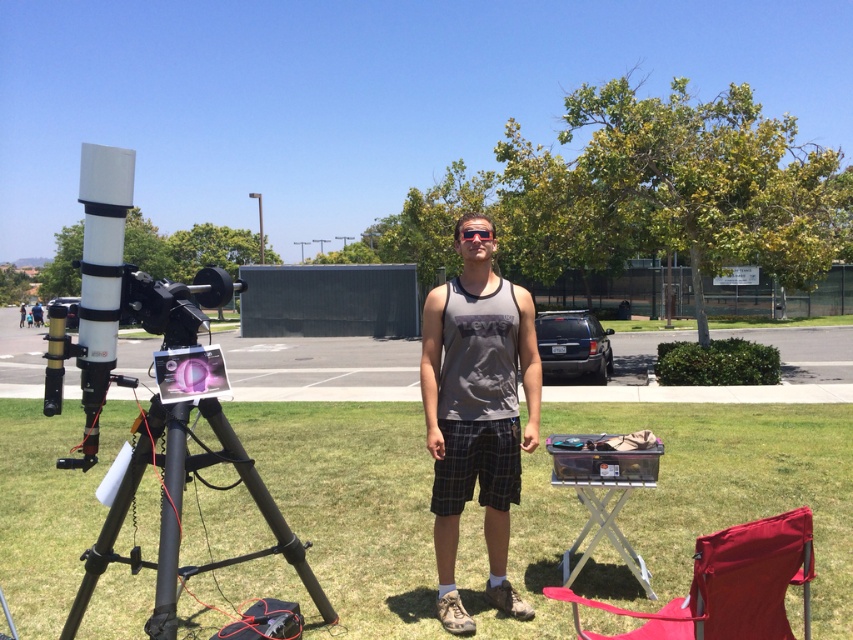
Which of these two, green grass at lower center or gray fabric tank top at center, stands shorter?

green grass at lower center

The image size is (853, 640). What do you see at coordinates (726, 492) in the screenshot?
I see `green grass at lower center` at bounding box center [726, 492].

Describe the element at coordinates (726, 492) in the screenshot. I see `green grass at lower center` at that location.

Where is `green grass at lower center`? green grass at lower center is located at coordinates (x=726, y=492).

Does green grass at lower center have a lesser height compared to black matte tripod at lower left?

Correct, green grass at lower center is not as tall as black matte tripod at lower left.

Find the location of a particular element. This screenshot has width=853, height=640. green grass at lower center is located at coordinates (726, 492).

Which of these two, gray fabric tank top at center or black matte tripod at lower left, stands shorter?

Standing shorter between the two is black matte tripod at lower left.

Between gray fabric tank top at center and black matte tripod at lower left, which one has more height?

With more height is gray fabric tank top at center.

What do you see at coordinates (477, 413) in the screenshot? I see `gray fabric tank top at center` at bounding box center [477, 413].

Locate an element on the screen. The image size is (853, 640). gray fabric tank top at center is located at coordinates (477, 413).